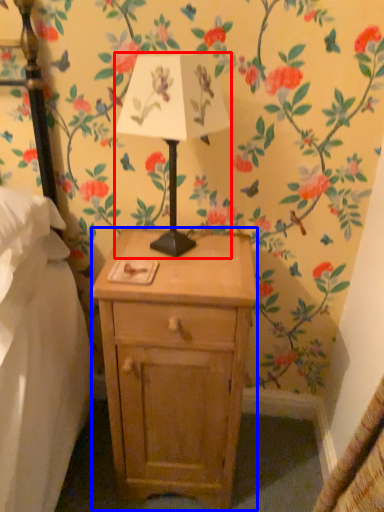
Question: Which of the following is the farthest to the observer, table lamp (highlighted by a red box) or nightstand (highlighted by a blue box)?

Choices:
 (A) table lamp
 (B) nightstand

Answer: (B)